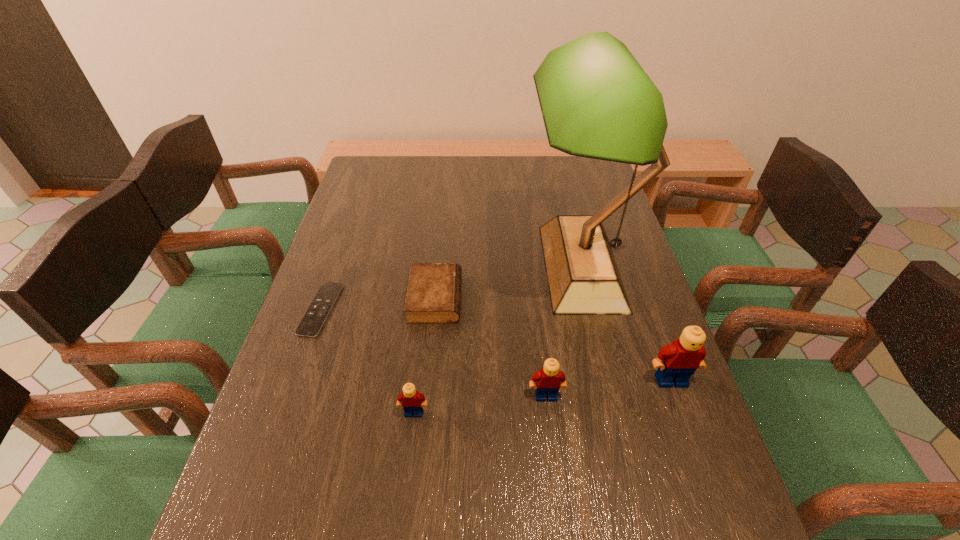
Given the evenly spaced Legos in the image, where should an extra Lego be added on the left to preserve the spacing? Please point to a vacant space. Please provide its 2D coordinates. Your answer should be formatted as a tuple, i.e. [(x, y)], where the tuple contains the x and y coordinates of a point satisfying the conditions above.

[(273, 430)]